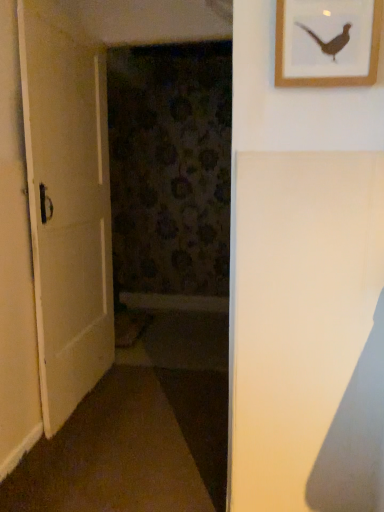
Question: Based on their sizes in the image, would you say wooden picture frame at upper right is bigger or smaller than white matte door at left?

Choices:
 (A) big
 (B) small

Answer: (B)

Question: Would you say wooden picture frame at upper right is inside or outside white matte door at left?

Choices:
 (A) outside
 (B) inside

Answer: (A)

Question: Is wooden picture frame at upper right taller or shorter than white matte door at left?

Choices:
 (A) short
 (B) tall

Answer: (A)

Question: From the image's perspective, is white matte door at left positioned above or below wooden picture frame at upper right?

Choices:
 (A) below
 (B) above

Answer: (A)

Question: Looking at the image, does white matte door at left seem bigger or smaller compared to wooden picture frame at upper right?

Choices:
 (A) big
 (B) small

Answer: (A)

Question: Is white matte door at left taller or shorter than wooden picture frame at upper right?

Choices:
 (A) tall
 (B) short

Answer: (A)

Question: Looking at their shapes, would you say white matte door at left is wider or thinner than wooden picture frame at upper right?

Choices:
 (A) thin
 (B) wide

Answer: (B)